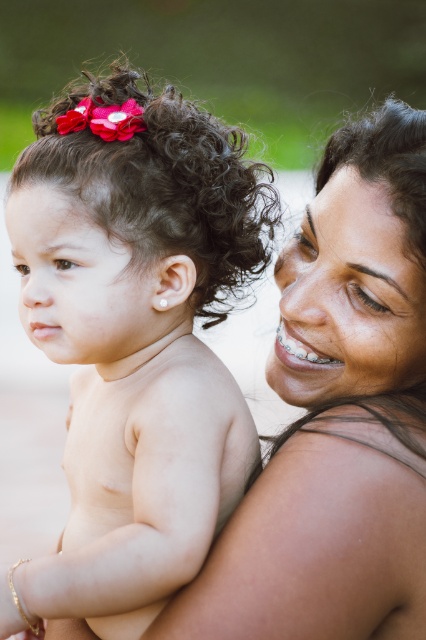
Question: Which of the following is the closest to the observer?

Choices:
 (A) (342, 632)
 (B) (382, 140)
 (C) (183, 289)

Answer: (A)

Question: Which point is closer to the camera?

Choices:
 (A) gold bracelet at center
 (B) dark curly hair at left
 (C) smooth skin mother at upper right

Answer: (A)

Question: Which point is farther to the camera?

Choices:
 (A) gold bracelet at center
 (B) dark curly hair at center
 (C) pale skin at upper right

Answer: (B)

Question: Is gold bracelet at center thinner than black shiny hair at upper right?

Choices:
 (A) no
 (B) yes

Answer: (A)

Question: Is smooth skin mother at upper right below gold bracelet at center?

Choices:
 (A) yes
 (B) no

Answer: (B)

Question: Does smooth skin baby at left appear under pale skin at upper right?

Choices:
 (A) no
 (B) yes

Answer: (A)